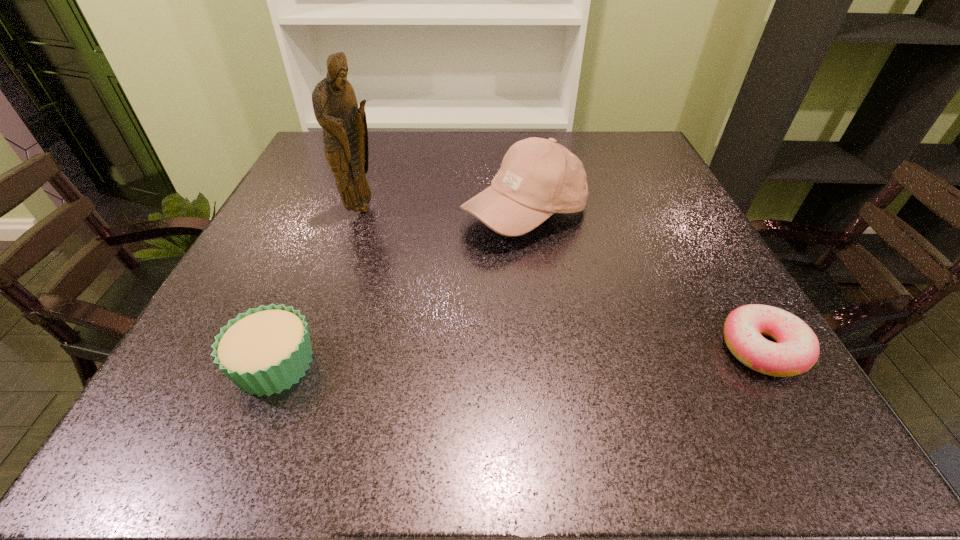
Where is `free region that satisfies the following two spatial constraints: 1. on the front side of the shortest object; 2. on the left side of the figurine`? The image size is (960, 540). free region that satisfies the following two spatial constraints: 1. on the front side of the shortest object; 2. on the left side of the figurine is located at coordinates (316, 348).